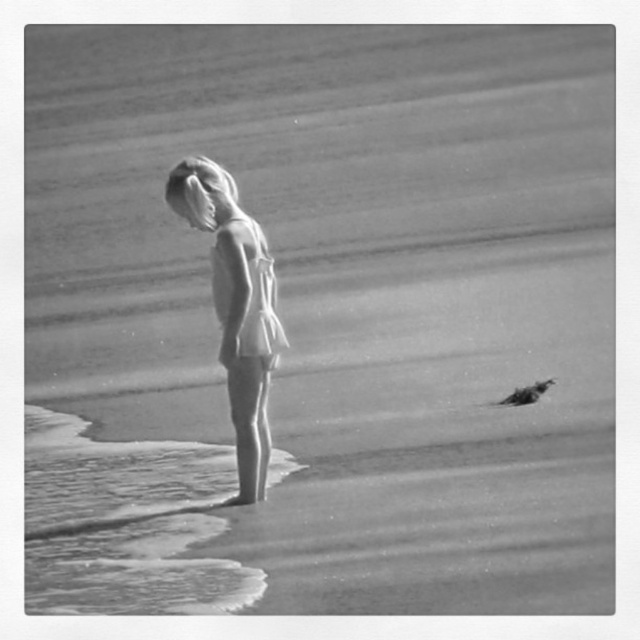
Question: In this image, where is clear water at lower left located relative to smooth feathered bird at lower right?

Choices:
 (A) above
 (B) below

Answer: (B)

Question: In this image, where is clear water at lower left located relative to smooth white dress at center?

Choices:
 (A) right
 (B) left

Answer: (B)

Question: Which object is positioned farthest from the clear water at lower left?

Choices:
 (A) smooth white dress at center
 (B) smooth feathered bird at lower right

Answer: (B)

Question: Is smooth white dress at center wider than smooth feathered bird at lower right?

Choices:
 (A) yes
 (B) no

Answer: (A)

Question: Which object is positioned farthest from the smooth feathered bird at lower right?

Choices:
 (A) clear water at lower left
 (B) smooth white dress at center

Answer: (A)

Question: Which point is closer to the camera taking this photo?

Choices:
 (A) (189, 184)
 (B) (177, 451)

Answer: (A)